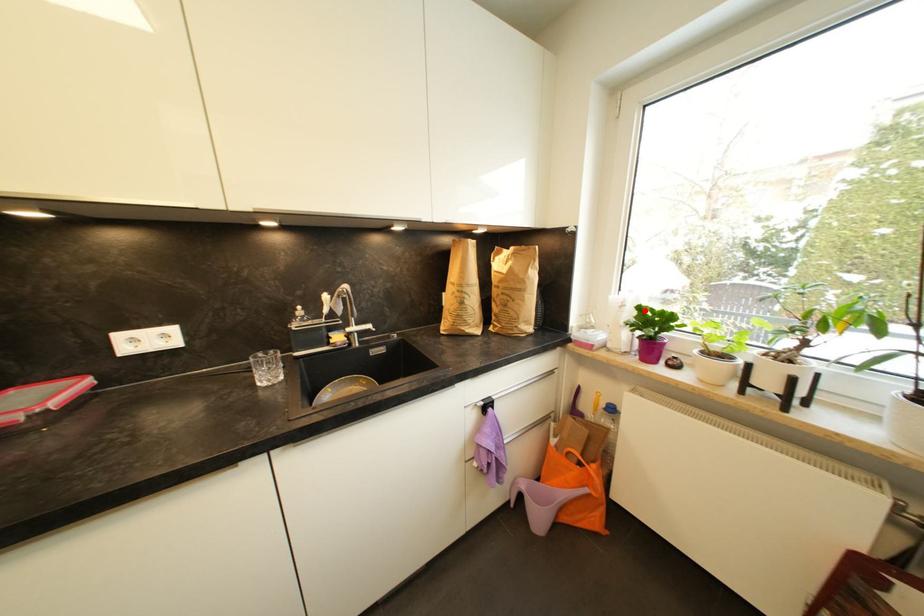
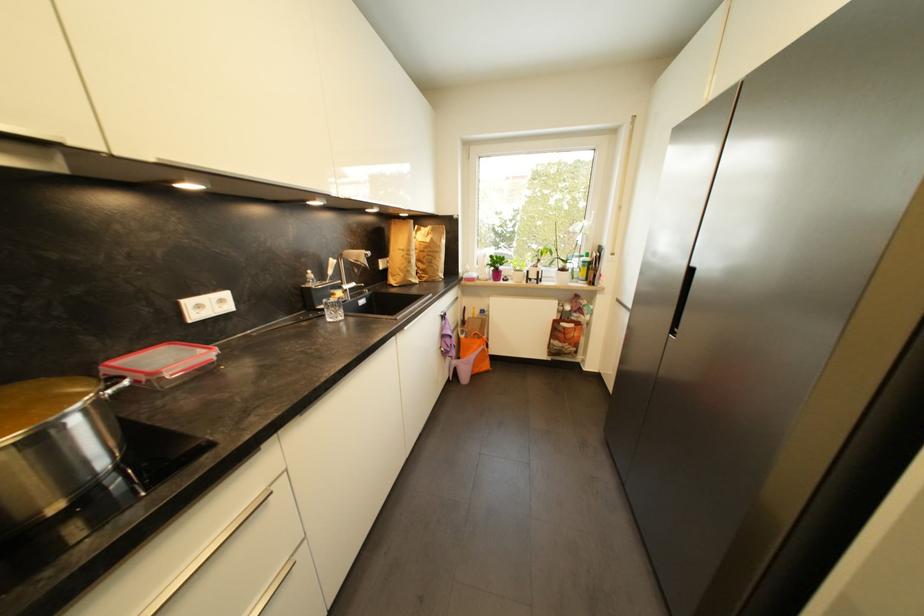
Question: I am providing you with two images of the same scene from different viewpoints. In image1, a red point is highlighted. Considering the same 3D point in image2, which of the following is correct?

Choices:
 (A) It is closer
 (B) It is farther

Answer: (A)